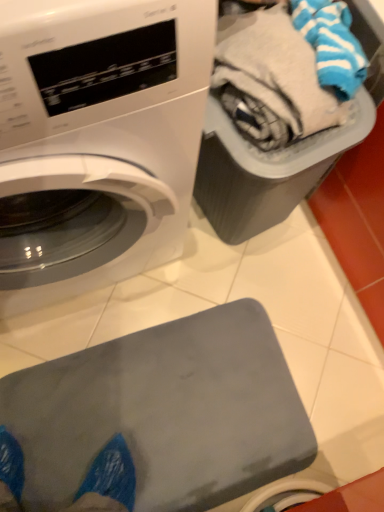
You are a GUI agent. You are given a task and a screenshot of the screen. Output one action in this format:
    pyautogui.click(x=<x>, y=<y>)
    Task: Click on the free location above gray rubber mat at lower center (from a real-world perspective)
    
    Given the screenshot: What is the action you would take?
    pyautogui.click(x=158, y=419)